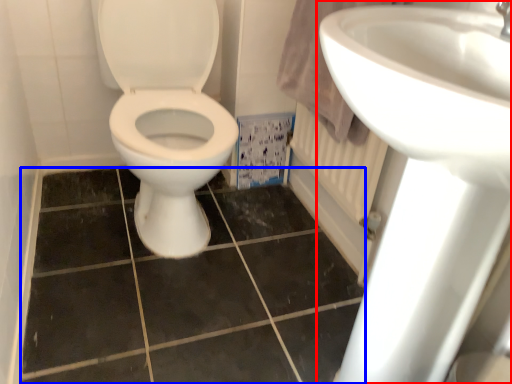
Question: Which object is further to the camera taking this photo, sink (highlighted by a red box) or ceramic tile (highlighted by a blue box)?

Choices:
 (A) sink
 (B) ceramic tile

Answer: (B)